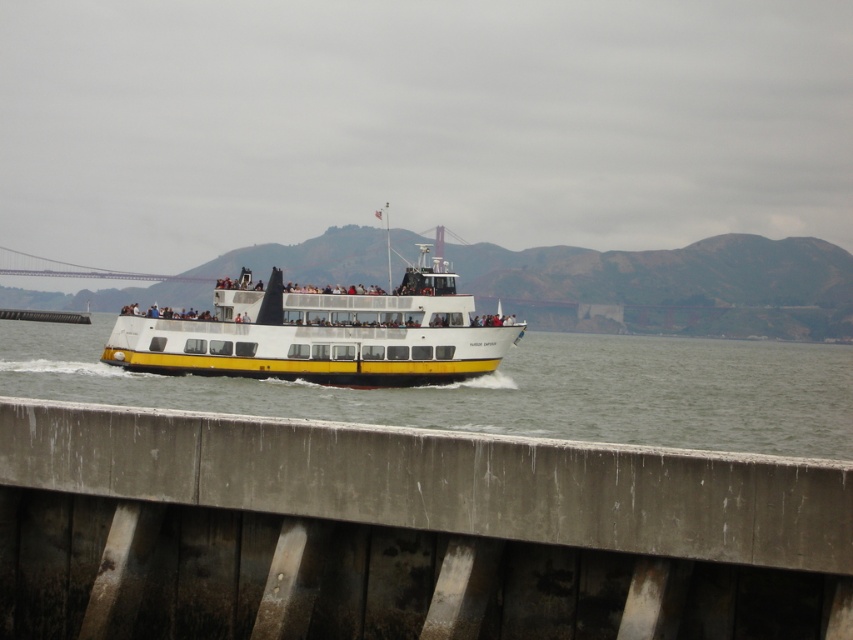
You are a photographer trying to capture the metallic gray bridge at center and the white matte water at center in a single shot. Based on their heights, which one would appear closer to the camera in the photo?

The metallic gray bridge at center has a lesser height compared to the white matte water at center, so it would appear closer to the camera in the photo.